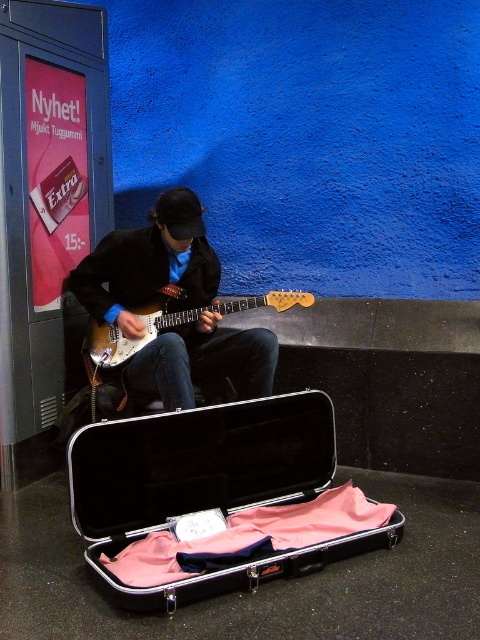
Does point (218, 353) come behind point (240, 307)?

Yes, point (218, 353) is farther from viewer.

Is matte black guitar at center above sunburst wood electric guitar at center?

Indeed, matte black guitar at center is positioned over sunburst wood electric guitar at center.

Measure the distance between point (163, 388) and camera.

Point (163, 388) and camera are 2.62 meters apart.

I want to click on matte black guitar at center, so click(172, 307).

Does metallic black case at lower center have a greater width compared to sunburst wood electric guitar at center?

Yes, metallic black case at lower center is wider than sunburst wood electric guitar at center.

Can you confirm if metallic black case at lower center is positioned to the left of sunburst wood electric guitar at center?

No, metallic black case at lower center is not to the left of sunburst wood electric guitar at center.

Image resolution: width=480 pixels, height=640 pixels. In order to click on metallic black case at lower center in this screenshot , I will do `click(216, 497)`.

Between metallic black case at lower center and matte black guitar at center, which one is positioned lower?

metallic black case at lower center is lower down.

Is point (70, 452) more distant than point (192, 237)?

No, (70, 452) is closer to viewer.

Locate an element on the screen. metallic black case at lower center is located at coordinates (216, 497).